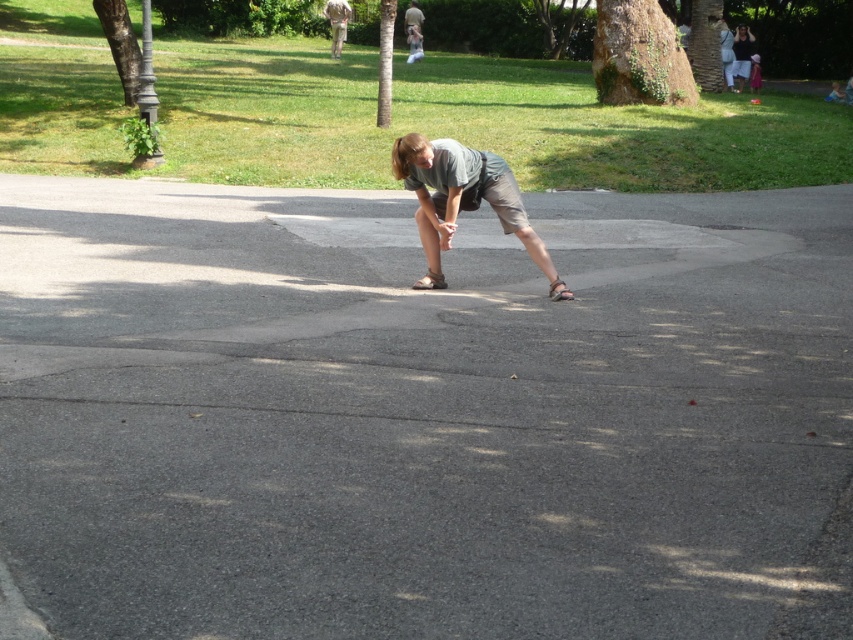
Who is higher up, gray asphalt at center or green grass at upper center?

Positioned higher is green grass at upper center.

Looking at this image, does gray asphalt at center have a greater width compared to green grass at upper center?

No, gray asphalt at center is not wider than green grass at upper center.

What do you see at coordinates (419, 412) in the screenshot? The height and width of the screenshot is (640, 853). I see `gray asphalt at center` at bounding box center [419, 412].

The height and width of the screenshot is (640, 853). I want to click on gray asphalt at center, so [x=419, y=412].

Does green grass at upper center have a greater width compared to matte gray shirt at upper right?

Yes.

Does point (720, 176) come farther from viewer compared to point (738, 83)?

No, it is not.

Who is more distant from viewer, (x=242, y=44) or (x=741, y=65)?

Point (x=242, y=44)

Locate an element on the screen. green grass at upper center is located at coordinates (471, 122).

Can you confirm if green grass at upper center is bigger than pink fabric dress at lower right?

Correct, green grass at upper center is larger in size than pink fabric dress at lower right.

Between point (532, 161) and point (753, 54), which one is positioned in front?

Point (532, 161)

At what (x,y) coordinates should I click in order to perform the action: click on green grass at upper center. Please return your answer as a coordinate pair (x, y). Image resolution: width=853 pixels, height=640 pixels. Looking at the image, I should click on (471, 122).